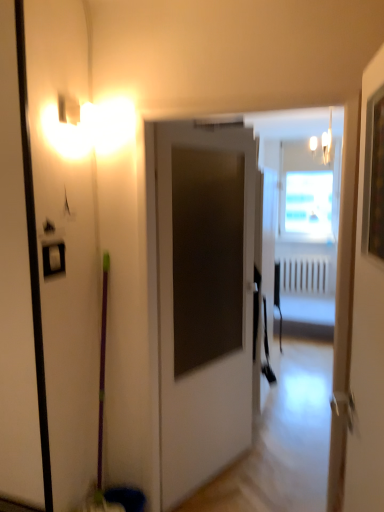
Question: From the image's perspective, is white matte door at center, the 2th door viewed from the front, located above white plastic radiator at center?

Choices:
 (A) no
 (B) yes

Answer: (A)

Question: Considering the relative sizes of white matte door at center, the 2th door viewed from the front, and white plastic radiator at center in the image provided, is white matte door at center, the 2th door viewed from the front, bigger than white plastic radiator at center?

Choices:
 (A) no
 (B) yes

Answer: (B)

Question: From the image's perspective, is white matte door at center, the 2th door viewed from the front, below white plastic radiator at center?

Choices:
 (A) yes
 (B) no

Answer: (A)

Question: Is white matte door at center, the 2th door viewed from the front, surrounding white plastic radiator at center?

Choices:
 (A) no
 (B) yes

Answer: (A)

Question: From a real-world perspective, is white matte door at center, the 2th door viewed from the front, beneath white plastic radiator at center?

Choices:
 (A) yes
 (B) no

Answer: (B)

Question: Is white matte door at center, the 2th door viewed from the front, in front of or behind white plastic radiator at center in the image?

Choices:
 (A) behind
 (B) front

Answer: (B)

Question: In terms of height, does white matte door at center, marked as the 1th door in a back-to-front arrangement, look taller or shorter compared to white plastic radiator at center?

Choices:
 (A) tall
 (B) short

Answer: (A)

Question: Based on their sizes in the image, would you say white matte door at center, marked as the 1th door in a back-to-front arrangement, is bigger or smaller than white plastic radiator at center?

Choices:
 (A) big
 (B) small

Answer: (A)

Question: From the image's perspective, is white matte door at center, the 2th door viewed from the front, above or below white plastic radiator at center?

Choices:
 (A) above
 (B) below

Answer: (B)

Question: In terms of width, does white glossy door at upper right, the first door positioned from the front, look wider or thinner when compared to white matte door at center, marked as the 1th door in a back-to-front arrangement?

Choices:
 (A) wide
 (B) thin

Answer: (B)

Question: Is point (340, 223) positioned closer to the camera than point (157, 309)?

Choices:
 (A) closer
 (B) farther

Answer: (A)

Question: Visually, is white glossy door at upper right, the first door positioned from the front, positioned to the left or to the right of white matte door at center, marked as the 1th door in a back-to-front arrangement?

Choices:
 (A) right
 (B) left

Answer: (A)

Question: From the image's perspective, relative to white matte door at center, the 2th door viewed from the front, is white glossy door at upper right, the first door positioned from the front, above or below?

Choices:
 (A) above
 (B) below

Answer: (A)

Question: From a real-world perspective, is white matte door at center, marked as the 1th door in a back-to-front arrangement, physically located above or below white glossy door at upper right, the first door positioned from the front?

Choices:
 (A) below
 (B) above

Answer: (A)

Question: Visually, is white matte door at center, marked as the 1th door in a back-to-front arrangement, positioned to the left or to the right of white glossy door at upper right, the first door positioned from the front?

Choices:
 (A) left
 (B) right

Answer: (A)